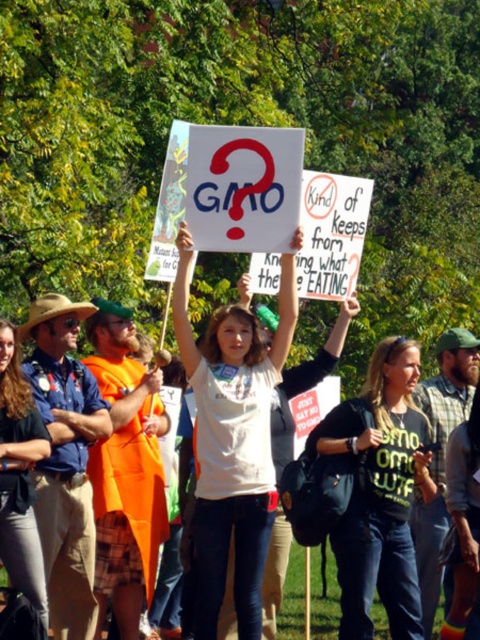
You are a photographer taking a picture of the protest scene. You notice two points in the image at coordinates point (355, 595) and point (3, 556). Which point is closer to the camera?

Point (3, 556) is closer to the camera because it is less further than point (355, 595).

You are a photographer at the protest. You want to capture a photo that includes both the green matte shirt at center and the denim pants at lower left. Which object should you focus on first to ensure both are in frame?

The green matte shirt at center is wider than the denim pants at lower left. To ensure both are in frame, focus on the wider object first, which is the green matte shirt at center.

You are a photographer standing at the edge of the park. You want to take a photo of the white cotton shirt at center and denim pants at lower left. If your camera can focus on objects within a 10 feet range, will both subjects be in focus?

The white cotton shirt at center is 8.34 feet from denim pants at lower left. Since the distance between them is within the 10 feet range, both subjects will be in focus.